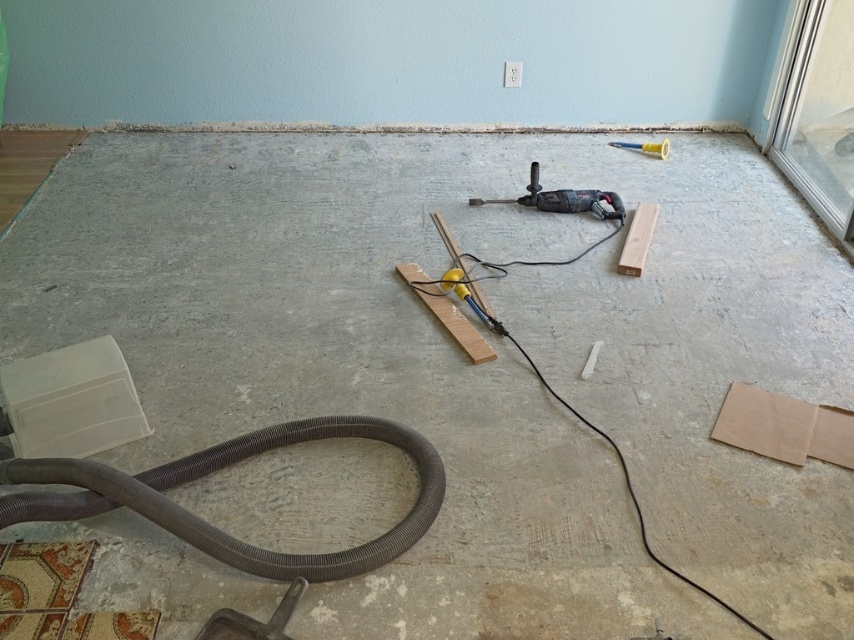
Which is below, gray rubber hose at lower left or yellow plastic hammer at upper right?

Positioned lower is gray rubber hose at lower left.

Does point (244, 552) come closer to viewer compared to point (613, 141)?

Yes, point (244, 552) is closer to viewer.

Is point (159, 467) closer to camera compared to point (657, 147)?

Yes, it is.

The width and height of the screenshot is (854, 640). Find the location of `gray rubber hose at lower left`. gray rubber hose at lower left is located at coordinates (217, 468).

Does gray rubber hose at lower left appear under transparent glass door at upper right?

Indeed, gray rubber hose at lower left is positioned under transparent glass door at upper right.

The image size is (854, 640). What do you see at coordinates (217, 468) in the screenshot? I see `gray rubber hose at lower left` at bounding box center [217, 468].

You are a GUI agent. You are given a task and a screenshot of the screen. Output one action in this format:
    pyautogui.click(x=<x>, y=<y>)
    Task: Click on the gray rubber hose at lower left
    
    Given the screenshot: What is the action you would take?
    pyautogui.click(x=217, y=468)

Is transparent glass door at upper right taller than yellow plastic hammer at upper right?

Yes, transparent glass door at upper right is taller than yellow plastic hammer at upper right.

Which is behind, point (828, 136) or point (662, 148)?

The point (662, 148) is behind.

Locate an element on the screen. Image resolution: width=854 pixels, height=640 pixels. transparent glass door at upper right is located at coordinates [x=819, y=115].